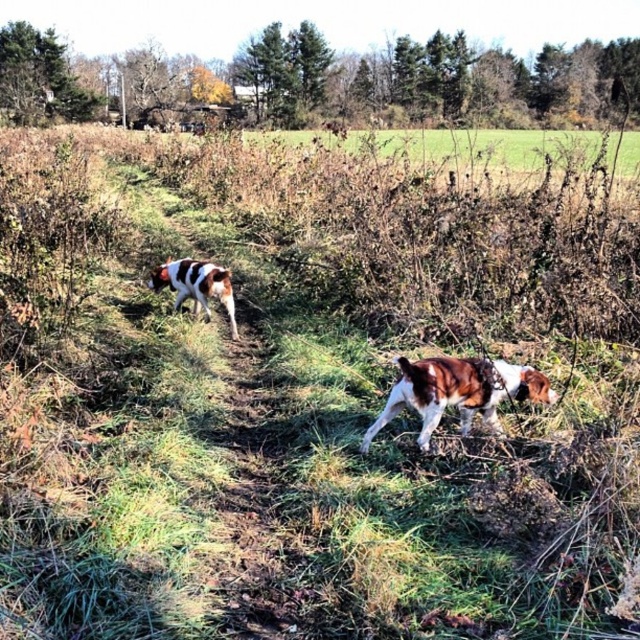
Question: Which point is closer to the camera taking this photo?

Choices:
 (A) [227, 282]
 (B) [474, 400]

Answer: (B)

Question: Which of the following is the closest to the observer?

Choices:
 (A) brown and white fur at center
 (B) brown and white speckled dog at left

Answer: (A)

Question: Is brown and white fur at center behind brown and white speckled dog at left?

Choices:
 (A) no
 (B) yes

Answer: (A)

Question: Does brown and white fur at center appear under brown and white speckled dog at left?

Choices:
 (A) yes
 (B) no

Answer: (A)

Question: Which object appears closest to the camera in this image?

Choices:
 (A) brown and white speckled dog at left
 (B) brown and white fur at center

Answer: (B)

Question: Does brown and white fur at center appear on the left side of brown and white speckled dog at left?

Choices:
 (A) yes
 (B) no

Answer: (B)